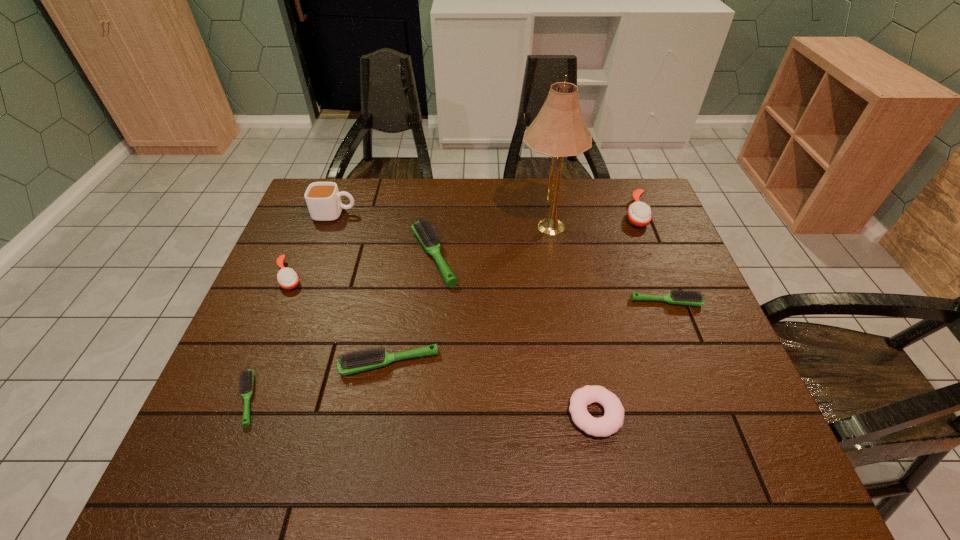
At what (x,y) coordinates should I click in order to perform the action: click on object that is at the far right corner. Please return your answer as a coordinate pair (x, y). The width and height of the screenshot is (960, 540). Looking at the image, I should click on (639, 214).

Locate an element on the screen. free space at the far edge is located at coordinates (429, 197).

Where is `vacant space at the near edge of the desktop`? The image size is (960, 540). vacant space at the near edge of the desktop is located at coordinates (410, 462).

This screenshot has height=540, width=960. In the image, there is a desktop. What are the coordinates of `vacant space at the left edge` in the screenshot? It's located at (325, 273).

At what (x,y) coordinates should I click in order to perform the action: click on free space at the right edge of the desktop. Please return your answer as a coordinate pair (x, y). Looking at the image, I should click on (692, 320).

Identify the location of vacant space at the far right corner. The image size is (960, 540). (646, 195).

Where is `free space at the near right corner of the desktop`? The width and height of the screenshot is (960, 540). free space at the near right corner of the desktop is located at coordinates (766, 479).

The width and height of the screenshot is (960, 540). What are the coordinates of `vacant point located between the cup and the third smallest light hairbrush` in the screenshot? It's located at click(363, 288).

This screenshot has width=960, height=540. I want to click on vacant area that lies between the beige lampshade and the fifth tallest hairbrush, so click(606, 265).

The width and height of the screenshot is (960, 540). Find the location of `unoccupied area between the lampshade and the biggest light hairbrush`. unoccupied area between the lampshade and the biggest light hairbrush is located at coordinates (490, 242).